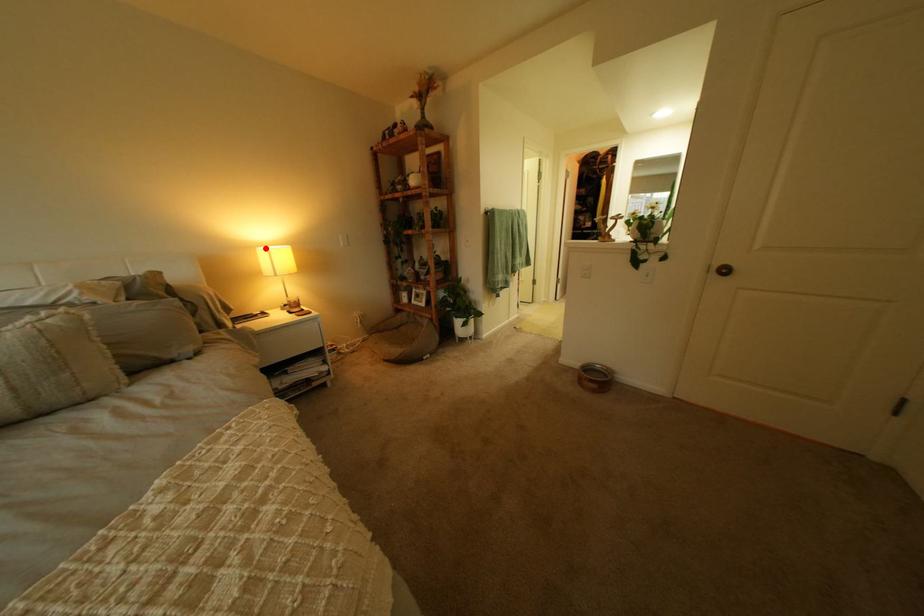
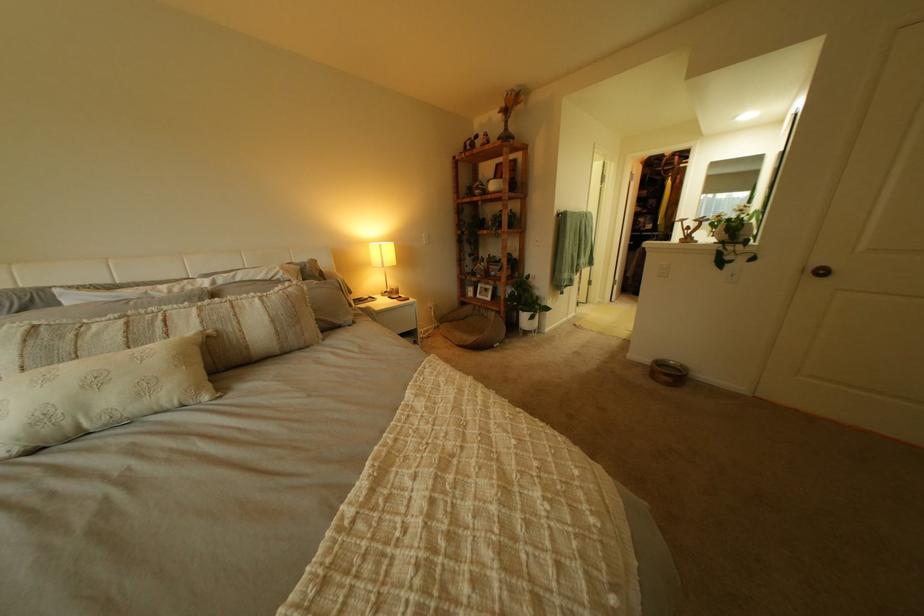
Locate, in the second image, the point that corresponds to the highlighted location in the first image.

(381, 244)